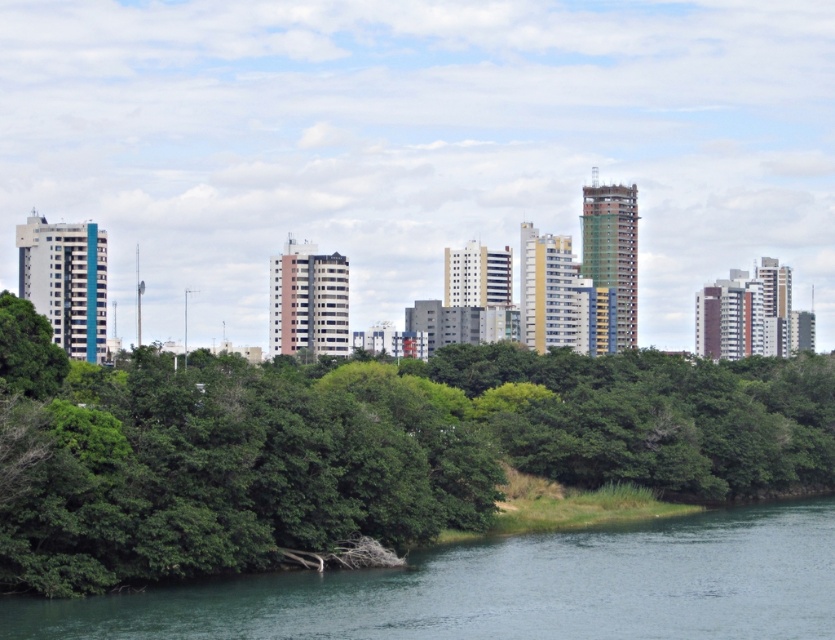
Is the position of green leafy tree at center less distant than that of greenish-blue water at lower center?

No, it is behind greenish-blue water at lower center.

Is point (29, 308) more distant than point (676, 614)?

Yes, it is behind point (676, 614).

Where is `green leafy tree at center`? green leafy tree at center is located at coordinates (362, 448).

Locate an element on the screen. green leafy tree at center is located at coordinates (362, 448).